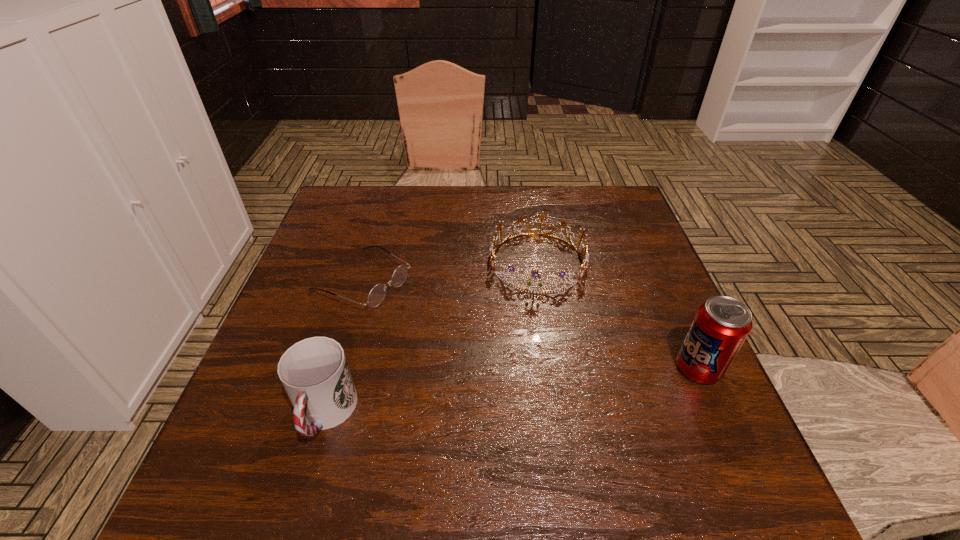
I want to click on free location at the left edge, so click(355, 278).

Identify the location of free space at the right edge. (671, 375).

In the image, there is a desktop. Where is `vacant space at the far left corner`? vacant space at the far left corner is located at coordinates (372, 225).

Where is `vacant region at the far right corner of the desktop`? Image resolution: width=960 pixels, height=540 pixels. vacant region at the far right corner of the desktop is located at coordinates (589, 214).

Image resolution: width=960 pixels, height=540 pixels. In the image, there is a desktop. What are the coordinates of `vacant space at the near right corner` in the screenshot? It's located at 671,450.

The width and height of the screenshot is (960, 540). Find the location of `free point between the cup and the spectacles`. free point between the cup and the spectacles is located at coordinates (344, 347).

What are the coordinates of `empty location between the second object from right to left and the spectacles` in the screenshot? It's located at (450, 271).

Find the location of a particular element. Image resolution: width=960 pixels, height=540 pixels. vacant area that lies between the rightmost object and the spectacles is located at coordinates (530, 324).

This screenshot has width=960, height=540. Identify the location of vacant point located between the spectacles and the second tallest object. (344, 347).

In order to click on free space between the tallest object and the third object from left to right in this screenshot , I will do `click(618, 315)`.